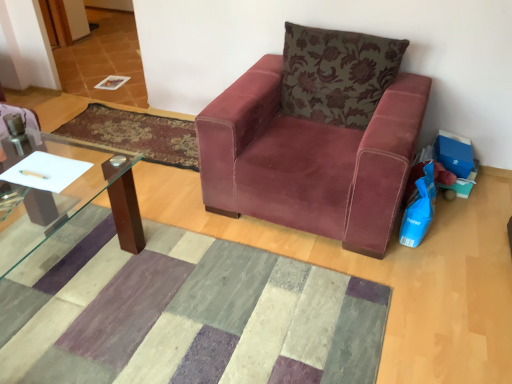
You are a GUI agent. You are given a task and a screenshot of the screen. Output one action in this format:
    pyautogui.click(x=<x>, y=<y>)
    Task: Click on the textured wool mat at center, the 2th mat viewed from the top
    Image resolution: width=512 pixels, height=384 pixels.
    Given the screenshot: What is the action you would take?
    pyautogui.click(x=184, y=313)

Measure the distance between point (423, 96) and camera.

Point (423, 96) and camera are 2.12 meters apart.

Where is `velvet-like burgundy mat at center, acting as the second mat starting from the front`? The width and height of the screenshot is (512, 384). velvet-like burgundy mat at center, acting as the second mat starting from the front is located at coordinates (137, 134).

At what (x,y) coordinates should I click in order to perform the action: click on textured wool mat at center, the 2th mat viewed from the top. Please return your answer as a coordinate pair (x, y). This screenshot has height=384, width=512. Looking at the image, I should click on (184, 313).

Is velvet maroon armchair at center positioned with its back to textured wool mat at center, which is the 2th mat in back-to-front order?

velvet maroon armchair at center is not turned away from textured wool mat at center, which is the 2th mat in back-to-front order.

Is velvet maroon armchair at center directly adjacent to textured wool mat at center, which is the 2th mat in back-to-front order?

There is a gap between velvet maroon armchair at center and textured wool mat at center, which is the 2th mat in back-to-front order.

Where is `the 1st mat counting from the left of the velvet maroon armchair at center`? The image size is (512, 384). the 1st mat counting from the left of the velvet maroon armchair at center is located at coordinates (184, 313).

How many degrees apart are the facing directions of velvet maroon armchair at center and textured wool mat at center, arranged as the first mat when ordered from the bottom?

They differ by 179 degrees in their facing directions.

Identify the location of pillow in front of the velvet-like burgundy mat at center, arranged as the first mat when viewed from the back. Image resolution: width=512 pixels, height=384 pixels. (336, 74).

From the image's perspective, is floral-patterned velvet pillow at upper right on velvet-like burgundy mat at center, the 2th mat ordered from the bottom?

Indeed, from the image's perspective, floral-patterned velvet pillow at upper right is shown above velvet-like burgundy mat at center, the 2th mat ordered from the bottom.

From a real-world perspective, which object stands above the other?

floral-patterned velvet pillow at upper right is physically above.

How distant is velvet-like burgundy mat at center, the 2th mat ordered from the bottom, from floral-patterned velvet pillow at upper right?

They are 3.40 feet apart.

Which is further, [124,120] or [345,84]?

The point [124,120] is behind.

Is velvet-like burgundy mat at center, which is counted as the 1th mat, starting from the top, not near floral-patterned velvet pillow at upper right?

Yes, velvet-like burgundy mat at center, which is counted as the 1th mat, starting from the top, is far from floral-patterned velvet pillow at upper right.

Is the position of velvet-like burgundy mat at center, which is counted as the 1th mat, starting from the top, less distant than that of floral-patterned velvet pillow at upper right?

No, velvet-like burgundy mat at center, which is counted as the 1th mat, starting from the top, is further to the viewer.

Which is more to the right, velvet-like burgundy mat at center, arranged as the first mat when viewed from the back, or velvet maroon armchair at center?

Positioned to the right is velvet maroon armchair at center.

Considering the points (54, 130) and (322, 219), which point is in front, point (54, 130) or point (322, 219)?

The point (322, 219) is more forward.

Does velvet-like burgundy mat at center, the 2th mat ordered from the bottom, have a greater height compared to velvet maroon armchair at center?

No.

From a real-world perspective, which mat is the 2nd one underneath the velvet maroon armchair at center? Please provide its 2D coordinates.

[(137, 134)]

Is the depth of floral-patterned velvet pillow at upper right greater than that of velvet maroon armchair at center?

That is True.

Is the surface of floral-patterned velvet pillow at upper right in direct contact with velvet maroon armchair at center?

No, floral-patterned velvet pillow at upper right is not touching velvet maroon armchair at center.

Considering the sizes of floral-patterned velvet pillow at upper right and velvet maroon armchair at center in the image, is floral-patterned velvet pillow at upper right wider or thinner than velvet maroon armchair at center?

In the image, floral-patterned velvet pillow at upper right appears to be more narrow than velvet maroon armchair at center.

Considering the positions of objects metallic silver pen at lower left and floral-patterned velvet pillow at upper right in the image provided, who is in front, metallic silver pen at lower left or floral-patterned velvet pillow at upper right?

metallic silver pen at lower left.

Measure the distance between metallic silver pen at lower left and floral-patterned velvet pillow at upper right.

A distance of 1.49 meters exists between metallic silver pen at lower left and floral-patterned velvet pillow at upper right.

From a real-world perspective, does metallic silver pen at lower left sit lower than floral-patterned velvet pillow at upper right?

Indeed, from a real-world perspective, metallic silver pen at lower left is positioned beneath floral-patterned velvet pillow at upper right.

Is metallic silver pen at lower left oriented towards floral-patterned velvet pillow at upper right?

No.

From the image's perspective, is textured wool mat at center, which is the 2th mat in back-to-front order, located above or below velvet maroon armchair at center?

From the image's perspective, textured wool mat at center, which is the 2th mat in back-to-front order, appears below velvet maroon armchair at center.

In the scene shown: What's the angular difference between textured wool mat at center, the 2th mat viewed from the top, and velvet maroon armchair at center's facing directions?

They differ by 179 degrees in their facing directions.

From a real-world perspective, is textured wool mat at center, arranged as the first mat when ordered from the bottom, positioned over velvet maroon armchair at center based on gravity?

No, from a real-world perspective, textured wool mat at center, arranged as the first mat when ordered from the bottom, is not above velvet maroon armchair at center.

Is textured wool mat at center, arranged as the first mat when ordered from the bottom, positioned behind velvet maroon armchair at center?

No, it is in front of velvet maroon armchair at center.

Where is `chair above the textured wool mat at center, the 2th mat viewed from the top (from the image's perspective)`? This screenshot has width=512, height=384. chair above the textured wool mat at center, the 2th mat viewed from the top (from the image's perspective) is located at coordinates (316, 137).

In order to click on pillow to the right of velvet-like burgundy mat at center, the 2th mat ordered from the bottom in this screenshot , I will do `click(336, 74)`.

Based on their spatial positions, is metallic silver pen at lower left or velvet-like burgundy mat at center, arranged as the first mat when viewed from the back, further from floral-patterned velvet pillow at upper right?

metallic silver pen at lower left.

Consider the image. Which object lies nearer to the anchor point velvet maroon armchair at center, floral-patterned velvet pillow at upper right or textured wool mat at center, arranged as the first mat when ordered from the bottom?

floral-patterned velvet pillow at upper right is closer to velvet maroon armchair at center.

When comparing their distances from textured wool mat at center, the first mat positioned from the front, does velvet-like burgundy mat at center, the 2th mat ordered from the bottom, or velvet maroon armchair at center seem further?

Based on the image, velvet-like burgundy mat at center, the 2th mat ordered from the bottom, appears to be further to textured wool mat at center, the first mat positioned from the front.

When comparing their distances from velvet-like burgundy mat at center, which is counted as the 1th mat, starting from the top, does floral-patterned velvet pillow at upper right or textured wool mat at center, the 2th mat viewed from the top, seem closer?

floral-patterned velvet pillow at upper right is positioned closer to the anchor velvet-like burgundy mat at center, which is counted as the 1th mat, starting from the top.

Which object lies nearer to the anchor point metallic silver pen at lower left, floral-patterned velvet pillow at upper right or textured wool mat at center, which is the 2th mat in back-to-front order?

textured wool mat at center, which is the 2th mat in back-to-front order, is closer to metallic silver pen at lower left.

Based on their spatial positions, is velvet-like burgundy mat at center, which is counted as the 1th mat, starting from the top, or velvet maroon armchair at center further from metallic silver pen at lower left?

Among the two, velvet-like burgundy mat at center, which is counted as the 1th mat, starting from the top, is located further to metallic silver pen at lower left.

From the image, which object appears to be farther from velvet maroon armchair at center, metallic silver pen at lower left or textured wool mat at center, the 2th mat viewed from the top?

metallic silver pen at lower left lies further to velvet maroon armchair at center than the other object.

Based on their spatial positions, is metallic silver pen at lower left or floral-patterned velvet pillow at upper right closer to textured wool mat at center, arranged as the first mat when ordered from the bottom?

metallic silver pen at lower left.

The height and width of the screenshot is (384, 512). I want to click on pen located between textured wool mat at center, the 2th mat viewed from the top, and velvet-like burgundy mat at center, acting as the second mat starting from the front, in the depth direction, so click(33, 174).

This screenshot has height=384, width=512. I want to click on chair that lies between floral-patterned velvet pillow at upper right and textured wool mat at center, the 2th mat viewed from the top, from top to bottom, so click(316, 137).

Locate an element on the screen. The image size is (512, 384). pillow between textured wool mat at center, arranged as the first mat when ordered from the bottom, and velvet-like burgundy mat at center, which is counted as the 1th mat, starting from the top, in the front-back direction is located at coordinates (336, 74).

Locate an element on the screen. chair between textured wool mat at center, arranged as the first mat when ordered from the bottom, and velvet-like burgundy mat at center, the 2th mat ordered from the bottom, along the z-axis is located at coordinates (316, 137).